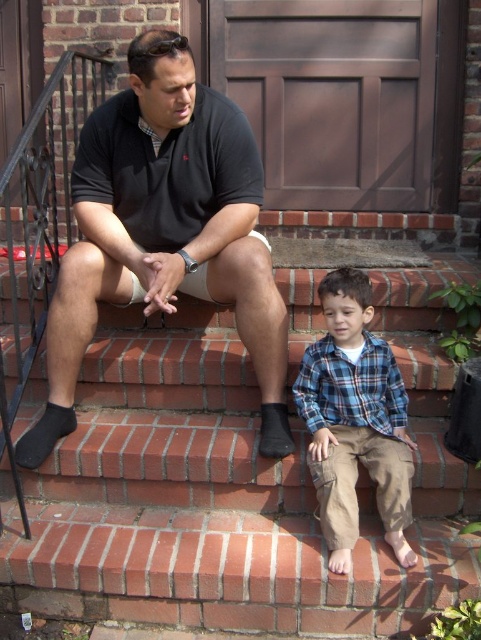
Based on the coordinates provided, where exactly is the black matte shirt at upper left located in the image?

The black matte shirt at upper left is located at coordinates point (164, 230).

You are standing in front of the brown wooden door and want to place a small object at the point closer to you. Which point should you choose between point (384, 627) and point (150, 108)?

Point (384, 627) is closer to the camera, so you should choose point (384, 627) to place the small object.

You are trying to place a small plant pot between the brick at center and the black matte shirt at upper left. Which object should you move closer to the other to make space?

The brick at center is wider than the black matte shirt at upper left, so you should move the black matte shirt at upper left closer to the brick at center to create space for the plant pot.